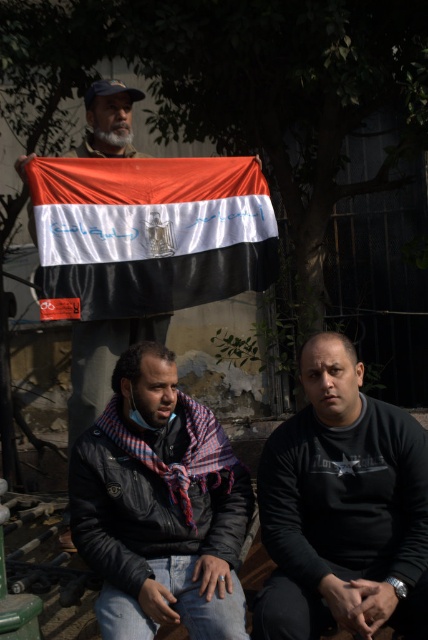
Can you confirm if matte fabric flag at upper center is positioned above matte black jacket at center?

Indeed, matte fabric flag at upper center is positioned over matte black jacket at center.

Is matte fabric flag at upper center smaller than matte black jacket at center?

No.

Is point (107, 234) in front of point (109, 342)?

Yes, it is in front of point (109, 342).

Where is `matte fabric flag at upper center`? matte fabric flag at upper center is located at coordinates (151, 230).

Between plaid scarf at center and matte black jacket at center, which one is positioned lower?

plaid scarf at center is lower down.

Does plaid scarf at center have a larger size compared to matte black jacket at center?

Indeed, plaid scarf at center has a larger size compared to matte black jacket at center.

This screenshot has height=640, width=428. What do you see at coordinates (160, 506) in the screenshot?
I see `plaid scarf at center` at bounding box center [160, 506].

Locate an element on the screen. plaid scarf at center is located at coordinates (160, 506).

Locate an element on the screen. black matte shirt at center is located at coordinates pyautogui.click(x=342, y=508).

Locate an element on the screen. This screenshot has height=640, width=428. black matte shirt at center is located at coordinates (342, 508).